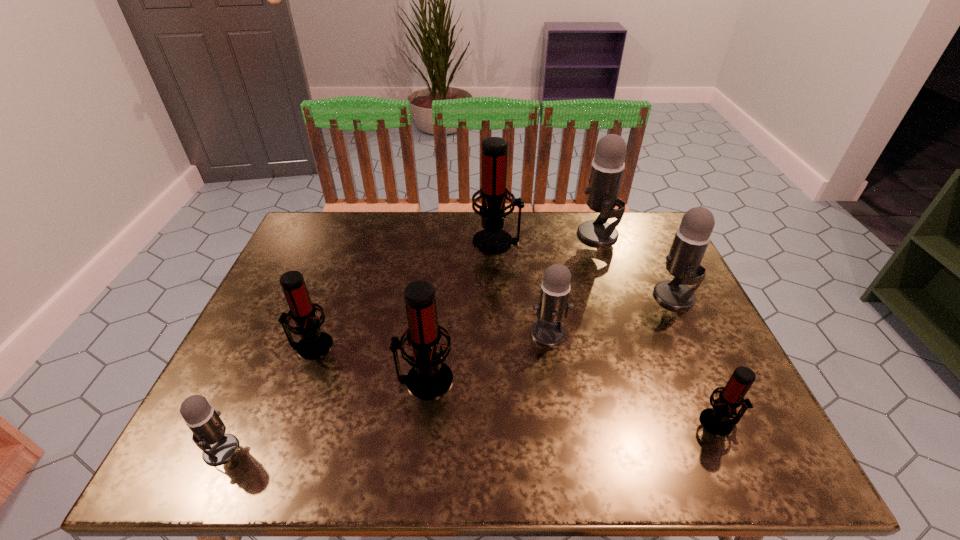
At what (x,y) coordinates should I click in order to perform the action: click on the second closest object to the farthest red microphone. Please return your answer as a coordinate pair (x, y). Image resolution: width=960 pixels, height=540 pixels. Looking at the image, I should click on (553, 307).

The height and width of the screenshot is (540, 960). Find the location of `microphone that is the closest to the rightmost red microphone`. microphone that is the closest to the rightmost red microphone is located at coordinates (692, 237).

At what (x,y) coordinates should I click in order to perform the action: click on microphone that stands as the second closest to the third biggest gray microphone. Please return your answer as a coordinate pair (x, y). Looking at the image, I should click on (692, 237).

The image size is (960, 540). What are the coordinates of `the third closest red microphone to the third red microphone from left to right` in the screenshot? It's located at (719, 420).

Locate which red microphone ranks second in proximity to the smallest gray microphone. Please provide its 2D coordinates. Your answer should be formatted as a tuple, i.e. [(x, y)], where the tuple contains the x and y coordinates of a point satisfying the conditions above.

[(429, 378)]

The image size is (960, 540). In order to click on gray microphone that can be found as the second closest to the third microphone from right to left in this screenshot , I will do `click(553, 307)`.

Where is `gray microphone that is the third closest one to the sixth object from left to right`? Image resolution: width=960 pixels, height=540 pixels. gray microphone that is the third closest one to the sixth object from left to right is located at coordinates 208,429.

The height and width of the screenshot is (540, 960). I want to click on vacant space that satisfies the following two spatial constraints: 1. on the front side of the second red microphone from left to right; 2. on the right side of the rightmost red microphone, so click(420, 422).